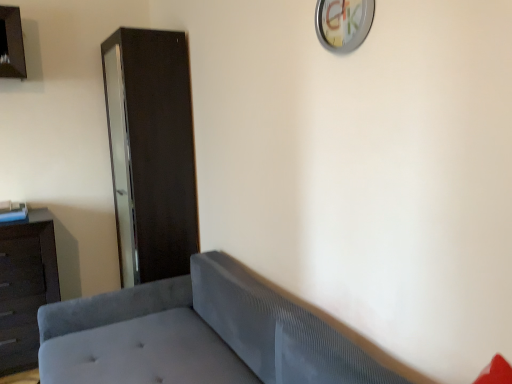
Question: Does point (355, 6) appear closer or farther from the camera than point (355, 380)?

Choices:
 (A) closer
 (B) farther

Answer: (B)

Question: From the image's perspective, is metallic silver clock at upper center above or below velvet gray studio couch at lower left?

Choices:
 (A) above
 (B) below

Answer: (A)

Question: Which object is positioned closest to the dark brown wood dresser at left?

Choices:
 (A) matte black cabinet at left
 (B) metallic silver clock at upper center
 (C) velvet gray studio couch at lower left

Answer: (A)

Question: Estimate the real-world distances between objects in this image. Which object is closer to the velvet gray studio couch at lower left?

Choices:
 (A) dark brown wood dresser at left
 (B) metallic silver clock at upper center
 (C) matte black cabinet at left

Answer: (C)